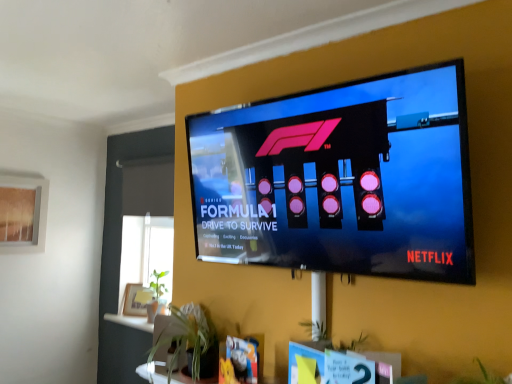
Describe the element at coordinates (190, 341) in the screenshot. This screenshot has height=384, width=512. I see `green leafy plant at lower center` at that location.

You are a GUI agent. You are given a task and a screenshot of the screen. Output one action in this format:
    pyautogui.click(x=<x>, y=<y>)
    Task: Click on the translucent glass window screen at upper left
    
    Given the screenshot: What is the action you would take?
    pyautogui.click(x=23, y=214)

What do you see at coordinates (23, 214) in the screenshot? Image resolution: width=512 pixels, height=384 pixels. I see `translucent glass window screen at upper left` at bounding box center [23, 214].

You are a GUI agent. You are given a task and a screenshot of the screen. Output one action in this format:
    pyautogui.click(x=<x>, y=<y>)
    Task: Click on the green leafy plant at lower center
    
    Given the screenshot: What is the action you would take?
    pyautogui.click(x=190, y=341)

I want to click on houseplant that appears behind the black glossy tv at upper center, so click(x=190, y=341).

Between green leafy plant at lower center and black glossy tv at upper center, which one has more height?

black glossy tv at upper center.

From a real-world perspective, which is physically below, green leafy plant at lower center or black glossy tv at upper center?

green leafy plant at lower center is physically lower.

Would you consider green leafy plant at lower center to be distant from black glossy tv at upper center?

No, green leafy plant at lower center is in close proximity to black glossy tv at upper center.

From the image's perspective, which one is positioned higher, green leafy plant at lower center or translucent glass window screen at upper left?

translucent glass window screen at upper left, from the image's perspective.

Are green leafy plant at lower center and translucent glass window screen at upper left far apart?

Yes, green leafy plant at lower center and translucent glass window screen at upper left are quite far apart.

Is green leafy plant at lower center taller or shorter than translucent glass window screen at upper left?

Clearly, green leafy plant at lower center is shorter compared to translucent glass window screen at upper left.

You are a GUI agent. You are given a task and a screenshot of the screen. Output one action in this format:
    pyautogui.click(x=<x>, y=<y>)
    Task: Click on the window screen behind the green leafy plant at lower center
    Image resolution: width=512 pixels, height=384 pixels.
    Given the screenshot: What is the action you would take?
    pyautogui.click(x=23, y=214)

From the image's perspective, is translucent glass window screen at upper left located beneath green leafy plant at lower center?

Actually, translucent glass window screen at upper left appears above green leafy plant at lower center in the image.

Is translucent glass window screen at upper left next to green leafy plant at lower center and touching it?

translucent glass window screen at upper left and green leafy plant at lower center are clearly separated.

Does translucent glass window screen at upper left have a lesser width compared to green leafy plant at lower center?

Indeed, translucent glass window screen at upper left has a lesser width compared to green leafy plant at lower center.

Can you confirm if black glossy tv at upper center is bigger than translucent glass window screen at upper left?

Correct, black glossy tv at upper center is larger in size than translucent glass window screen at upper left.

Consider the image. Is black glossy tv at upper center completely or partially outside of translucent glass window screen at upper left?

black glossy tv at upper center lies outside translucent glass window screen at upper left's area.

Which is closer to the camera, (282,234) or (22,239)?

The point (282,234) is closer to the camera.

Based on the photo, from the image's perspective, which is below, black glossy tv at upper center or translucent glass window screen at upper left?

translucent glass window screen at upper left.

From a real-world perspective, is translucent glass window screen at upper left on black glossy tv at upper center?

No, from a real-world perspective, translucent glass window screen at upper left is not over black glossy tv at upper center

From the picture: Between translucent glass window screen at upper left and black glossy tv at upper center, which one appears on the right side from the viewer's perspective?

black glossy tv at upper center is more to the right.

Is there a large distance between translucent glass window screen at upper left and black glossy tv at upper center?

translucent glass window screen at upper left is positioned a significant distance from black glossy tv at upper center.

In the scene shown: Which of these two, translucent glass window screen at upper left or black glossy tv at upper center, is smaller?

With smaller size is translucent glass window screen at upper left.

In the scene shown: Which object is further away from the camera, black glossy tv at upper center or green leafy plant at lower center?

green leafy plant at lower center is behind.

Between black glossy tv at upper center and green leafy plant at lower center, which one has larger size?

black glossy tv at upper center is bigger.

From a real-world perspective, who is located higher, black glossy tv at upper center or green leafy plant at lower center?

black glossy tv at upper center is physically above.

How different are the orientations of black glossy tv at upper center and green leafy plant at lower center in degrees?

The facing directions of black glossy tv at upper center and green leafy plant at lower center are 1.65e-05 degrees apart.

You are a GUI agent. You are given a task and a screenshot of the screen. Output one action in this format:
    pyautogui.click(x=<x>, y=<y>)
    Task: Click on the houseplant lying below the black glossy tv at upper center (from the image's perspective)
    The height and width of the screenshot is (384, 512).
    Given the screenshot: What is the action you would take?
    pyautogui.click(x=190, y=341)

Find the location of a particular element. Image resolution: width=512 pixels, height=384 pixels. window screen located on the left of green leafy plant at lower center is located at coordinates (23, 214).

Looking at the image, which one is located further to translucent glass window screen at upper left, black glossy tv at upper center or green leafy plant at lower center?

black glossy tv at upper center is positioned further to the anchor translucent glass window screen at upper left.

Consider the image. Based on their spatial positions, is translucent glass window screen at upper left or green leafy plant at lower center closer to black glossy tv at upper center?

Based on the image, green leafy plant at lower center appears to be nearer to black glossy tv at upper center.

Estimate the real-world distances between objects in this image. Which object is closer to green leafy plant at lower center, translucent glass window screen at upper left or black glossy tv at upper center?

Among the two, black glossy tv at upper center is located nearer to green leafy plant at lower center.

Based on their spatial positions, is green leafy plant at lower center or black glossy tv at upper center closer to translucent glass window screen at upper left?

green leafy plant at lower center lies closer to translucent glass window screen at upper left than the other object.

Which object lies further to the anchor point green leafy plant at lower center, black glossy tv at upper center or translucent glass window screen at upper left?

Among the two, translucent glass window screen at upper left is located further to green leafy plant at lower center.

Which object lies further to the anchor point black glossy tv at upper center, green leafy plant at lower center or translucent glass window screen at upper left?

Based on the image, translucent glass window screen at upper left appears to be further to black glossy tv at upper center.

Identify the location of houseplant between translucent glass window screen at upper left and black glossy tv at upper center. Image resolution: width=512 pixels, height=384 pixels. (190, 341).